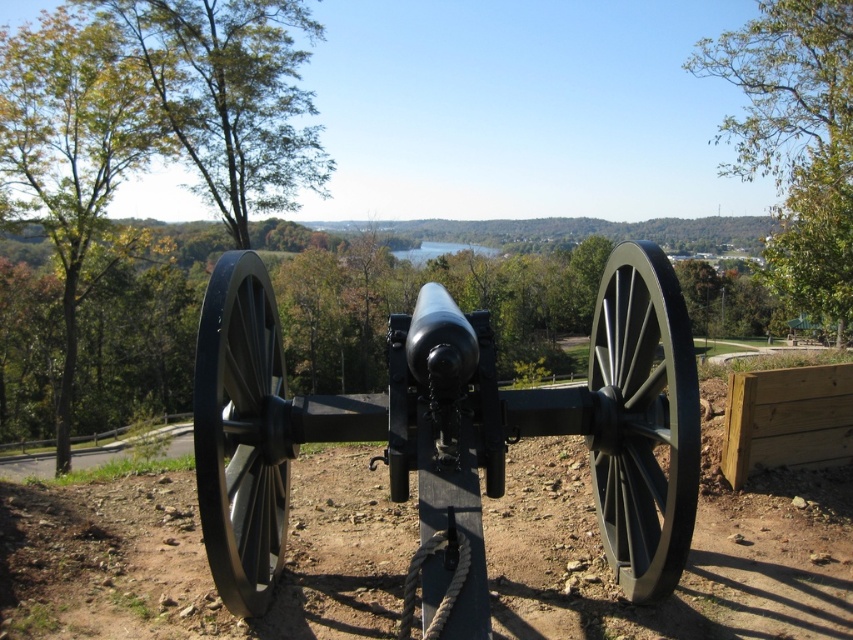
Between green leafy tree at upper left and clear water at center, which one is positioned lower?

Positioned lower is clear water at center.

Can you confirm if green leafy tree at upper left is bigger than clear water at center?

Indeed, green leafy tree at upper left has a larger size compared to clear water at center.

Which is behind, point (253, 196) or point (439, 243)?

Point (439, 243)

Find the location of `green leafy tree at upper left`. green leafy tree at upper left is located at coordinates (230, 97).

Can you confirm if matte black cannon at center is positioned below green leafy tree at upper left?

Yes.

Which is in front, point (659, 344) or point (287, 180)?

Point (659, 344) is in front.

Locate an element on the screen. Image resolution: width=853 pixels, height=640 pixels. matte black cannon at center is located at coordinates (450, 426).

Between point (270, 60) and point (105, 64), which one is positioned in front?

Point (105, 64)

Does green leafy tree at upper left appear on the left side of green leafy tree at left?

No, green leafy tree at upper left is not to the left of green leafy tree at left.

What are the coordinates of `green leafy tree at upper left` in the screenshot? It's located at (230, 97).

The height and width of the screenshot is (640, 853). Identify the location of green leafy tree at upper left. (230, 97).